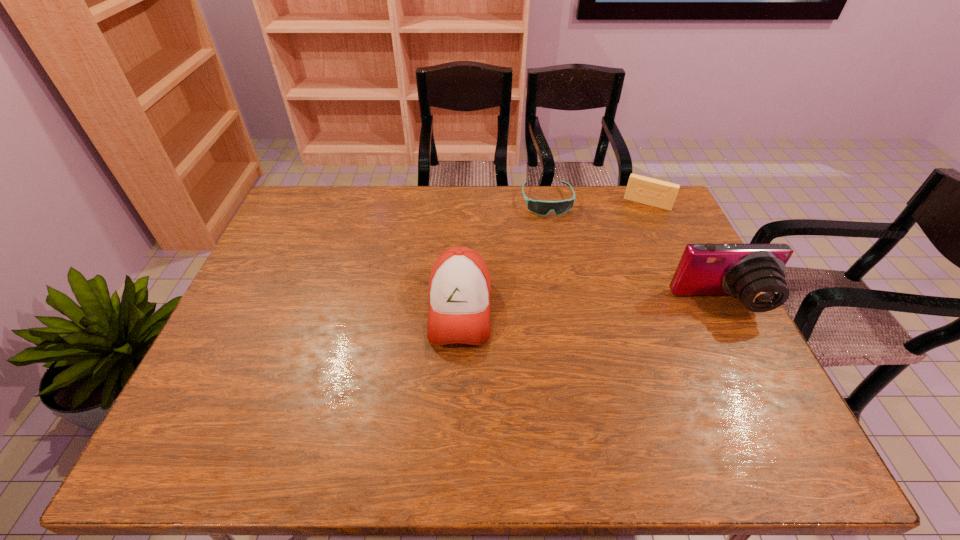
Select which object appears as the closest to the videotape. Please provide its 2D coordinates. Your answer should be formatted as a tuple, i.e. [(x, y)], where the tuple contains the x and y coordinates of a point satisfying the conditions above.

[(539, 207)]